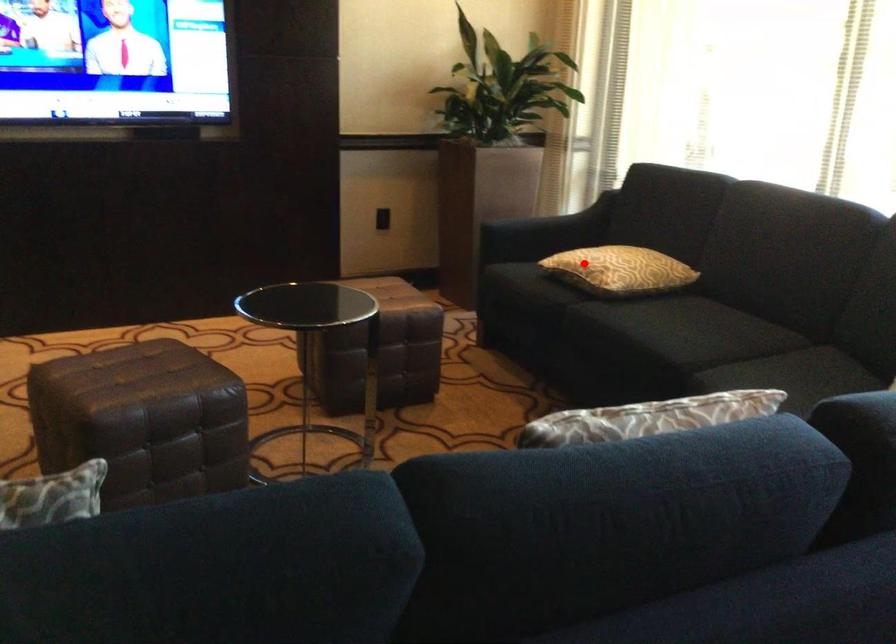
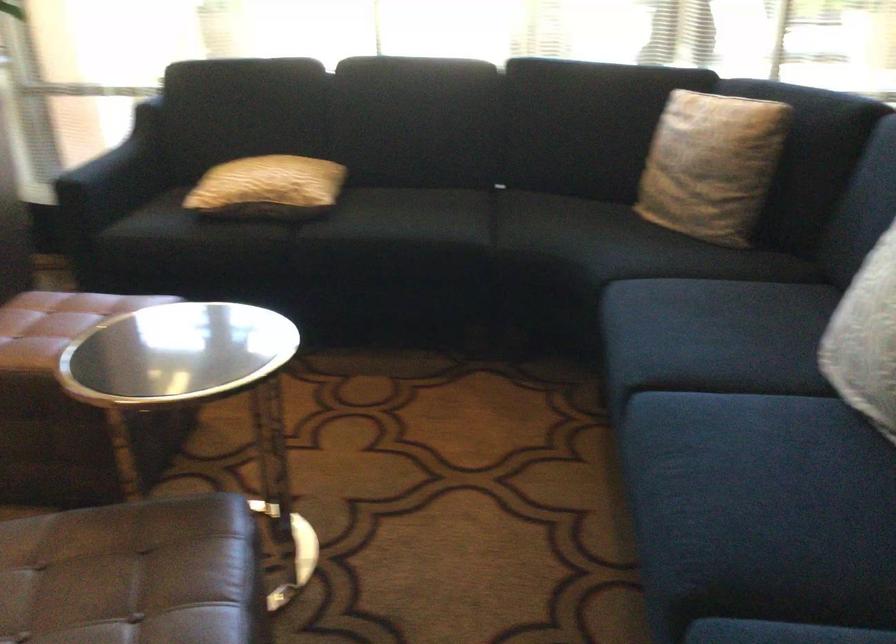
Question: I am providing you with two images of the same scene from different viewpoints. Image1 has a red point marked. In image2, the corresponding 3D location appears at what relative position? Reply with the corresponding letter.

Choices:
 (A) Closer
 (B) Farther

Answer: (A)